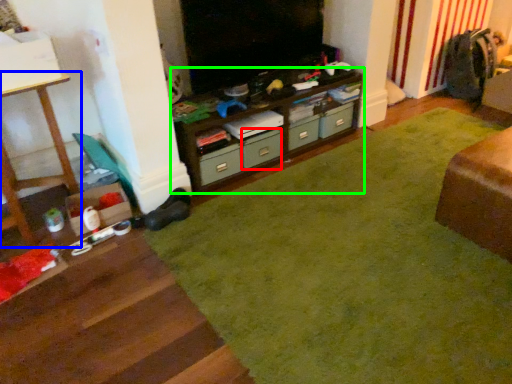
Question: Which object is positioned farthest from drawer (highlighted by a red box)? Select from furniture (highlighted by a blue box) and cabinetry (highlighted by a green box).

Choices:
 (A) furniture
 (B) cabinetry

Answer: (A)